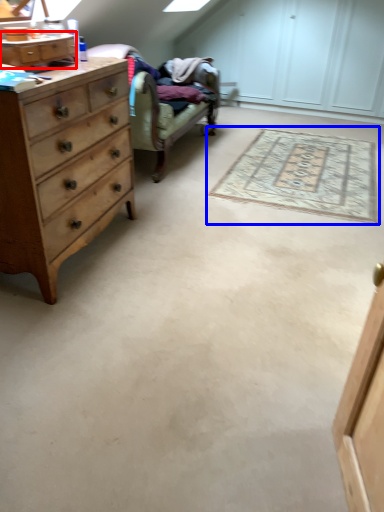
Question: Among these objects, which one is nearest to the camera, cabinetry (highlighted by a red box) or mat (highlighted by a blue box)?

Choices:
 (A) cabinetry
 (B) mat

Answer: (A)